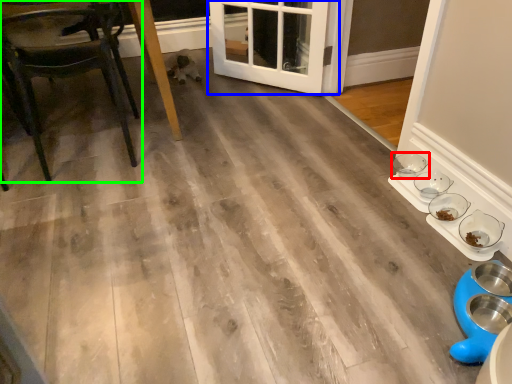
Question: Considering the real-world distances, which object is farthest from bowl (highlighted by a red box)? door (highlighted by a blue box) or chair (highlighted by a green box)?

Choices:
 (A) door
 (B) chair

Answer: (B)